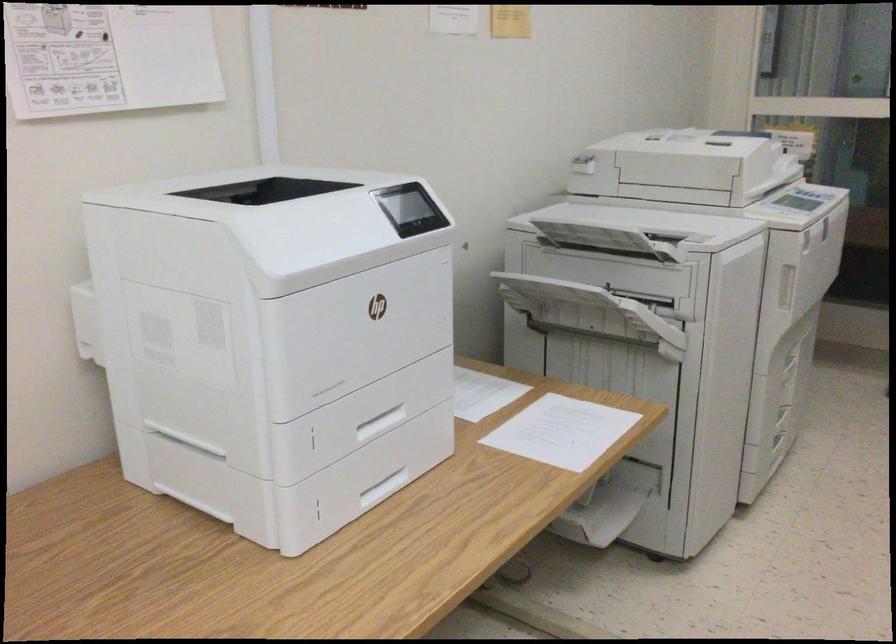
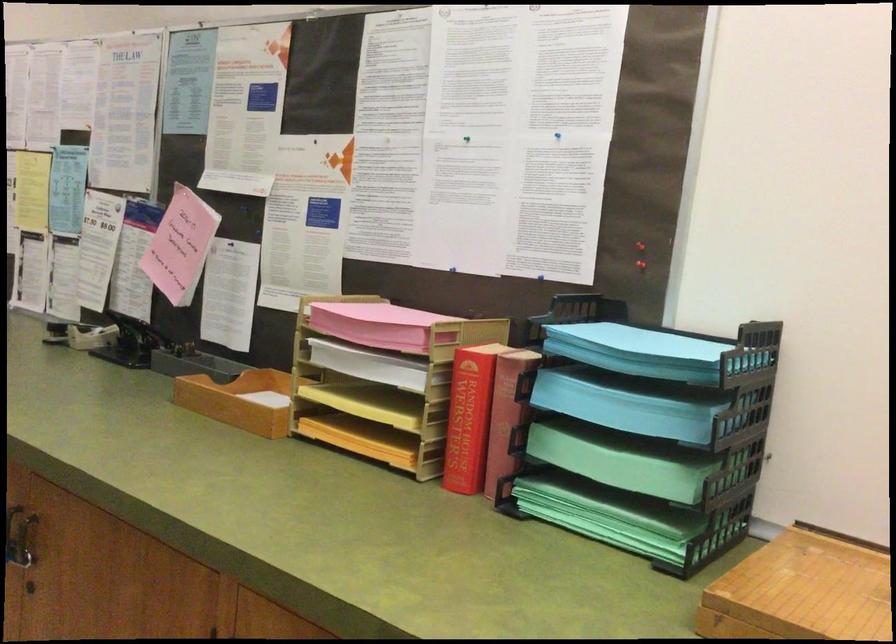
Question: Based on the continuous images, in which direction is the camera rotating? Reply with the corresponding letter.

Choices:
 (A) Left
 (B) Right
 (C) Up
 (D) Down

Answer: (B)